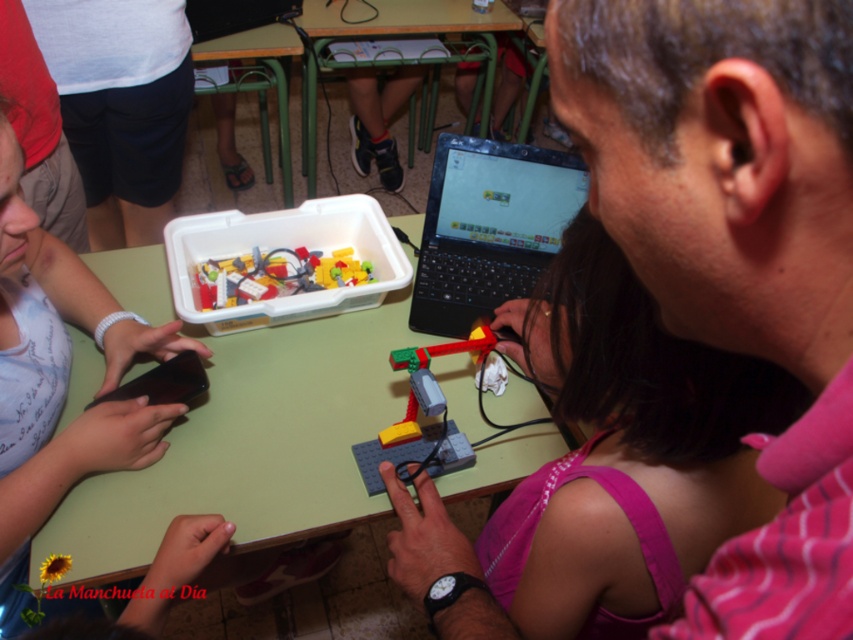
Can you confirm if pink fabric at center is positioned below translucent plastic robot at center?

No, pink fabric at center is not below translucent plastic robot at center.

Can you confirm if pink fabric at center is thinner than translucent plastic robot at center?

No.

Is point (416, 572) positioned behind point (416, 360)?

No, (416, 572) is closer to viewer.

Identify the location of pink fabric at center. (624, 456).

Based on the photo, which is more to the left, pink fabric at center or green metal table at upper center?

green metal table at upper center

Who is more forward, (x=666, y=467) or (x=285, y=44)?

Point (x=666, y=467)

The height and width of the screenshot is (640, 853). I want to click on pink fabric at center, so [624, 456].

Can you confirm if green plastic table at center is positioned below translucent plastic container at center?

Incorrect, green plastic table at center is not positioned below translucent plastic container at center.

Can you confirm if green plastic table at center is bigger than translucent plastic container at center?

Indeed, green plastic table at center has a larger size compared to translucent plastic container at center.

Between point (404, 88) and point (234, 269), which one is positioned behind?

Positioned behind is point (404, 88).

Where is `green plastic table at center`? The image size is (853, 640). green plastic table at center is located at coordinates (401, 17).